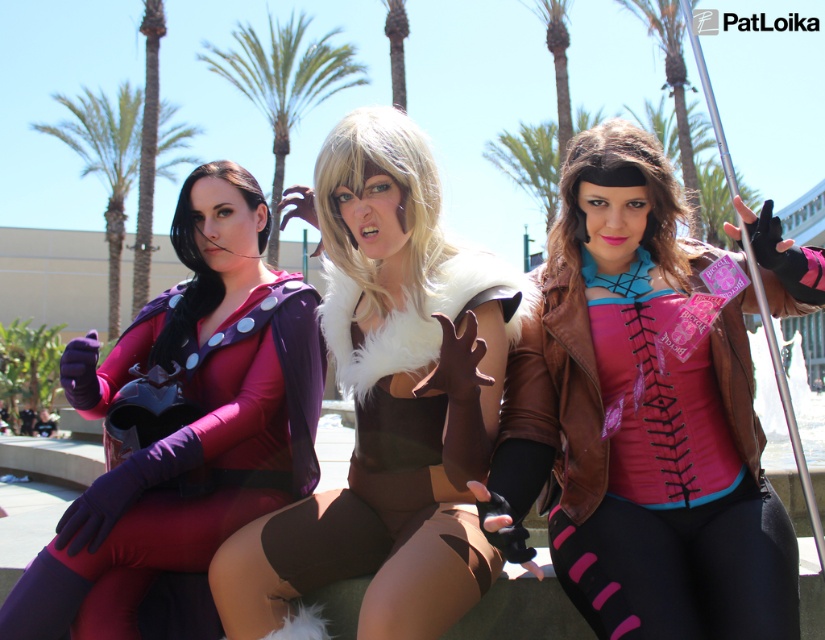
You are a photographer trying to capture a closeup shot of the two points in the image. Which point, point (389, 628) or point (225, 404), is closer to you?

Point (389, 628) is closer to the viewer than point (225, 404).

You are a photographer at the event and want to ensure the brown fur vest at center is fully visible in the photo. Is there anything blocking it from the green leafy palm tree at upper center?

The brown fur vest at center is positioned under the green leafy palm tree at upper center, so the palm tree may cast a shadow or partially block the vest depending on the angle and time of day. Adjust the camera angle or position to ensure the vest is fully visible without obstruction.

You are standing in front of the image and want to locate the brown fur vest at center. Which part of the image should you focus on?

The brown fur vest at center is located at point coordinates of [389,401].